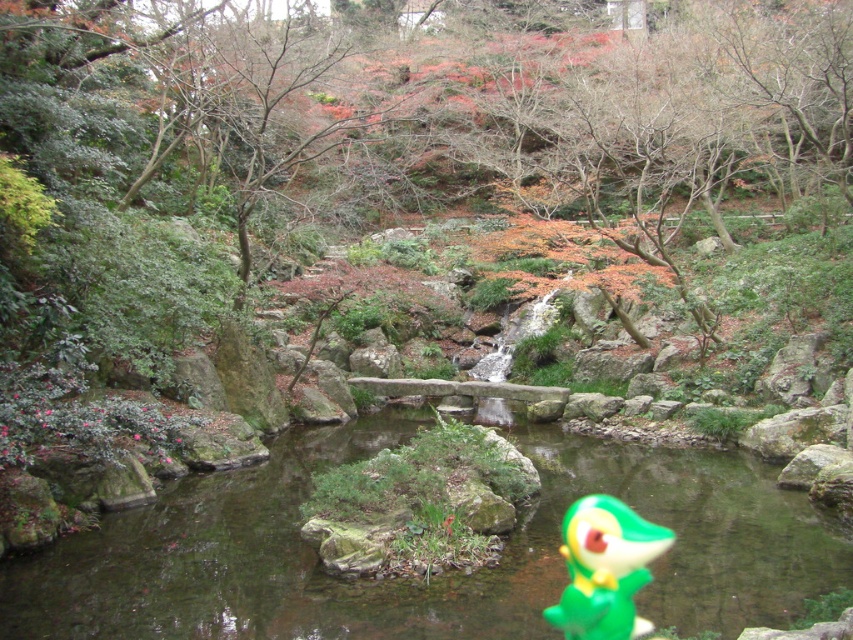
You are a visitor in the garden and want to cross the transparent plastic stream at center. You see a point at the location marked by point (x=432, y=577). Is this point on the transparent plastic stream at center?

The transparent plastic stream at center is represented by point (x=432, y=577), so yes, the point is on the stream.

You are a visitor at the garden and want to place a new decorative item between the transparent plastic stream at center and the green matte toy at center. Which object should you place it closer to if you want the new item to be more noticeable?

The green matte toy at center is smaller, so placing the new decorative item closer to it would make it more noticeable compared to the transparent plastic stream at center.

You are a child who wants to place the green matte toy at center into the transparent plastic stream at center. Can the toy fit into the stream without overlapping its edges?

The transparent plastic stream at center is wider than the green matte toy at center, so the toy can fit into the stream without overlapping its edges.